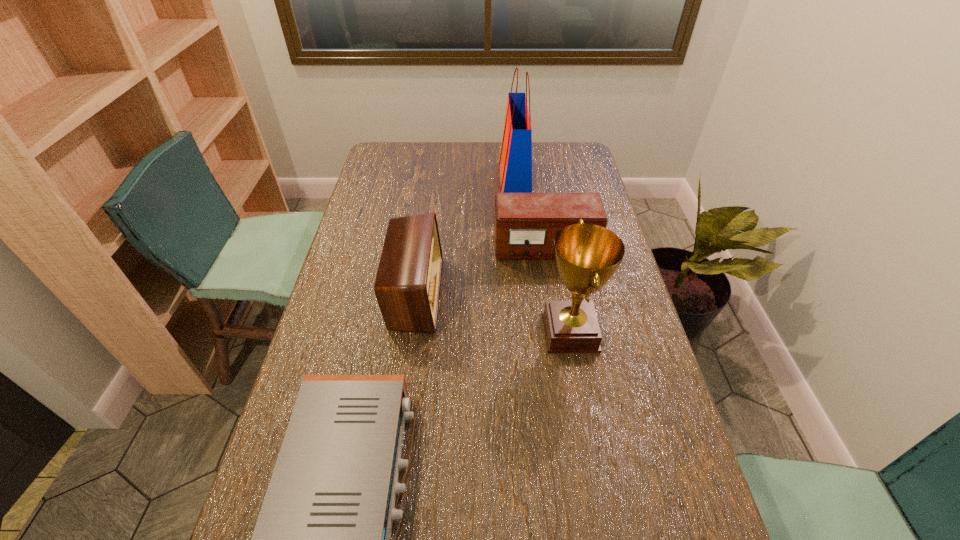
I want to click on shopping bag, so click(515, 162).

Identify the location of the farthest object. (515, 162).

Identify the location of the second tallest object. Image resolution: width=960 pixels, height=540 pixels. (587, 255).

This screenshot has height=540, width=960. I want to click on the rightmost radio receiver, so click(525, 224).

Where is `free space located 0.190m on the handle side of the tallest object`? The image size is (960, 540). free space located 0.190m on the handle side of the tallest object is located at coordinates (450, 181).

I want to click on vacant space located 0.270m on the handle side of the tallest object, so click(x=430, y=181).

At what (x,y) coordinates should I click in order to perform the action: click on vacant region located on the handle side of the tallest object. Please return your answer as a coordinate pair (x, y). The width and height of the screenshot is (960, 540). Looking at the image, I should click on (422, 181).

At what (x,y) coordinates should I click in order to perform the action: click on free space located on the plaque of the award. Please return your answer as a coordinate pair (x, y). Image resolution: width=960 pixels, height=540 pixels. Looking at the image, I should click on (442, 332).

I want to click on vacant space situated 0.230m on the plaque of the award, so click(x=457, y=332).

Where is `free spot located on the plaque of the award`? Image resolution: width=960 pixels, height=540 pixels. free spot located on the plaque of the award is located at coordinates (427, 332).